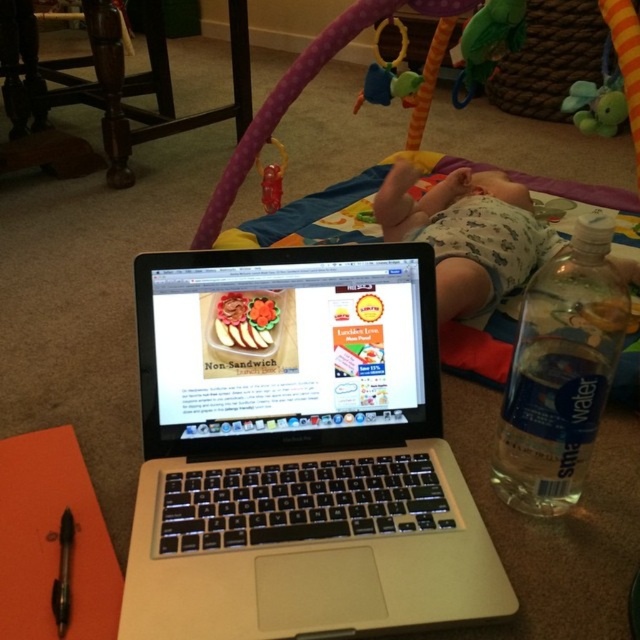
Which is below, green matte teether at upper right or rubberized plastic baby rattle at upper center?

green matte teether at upper right

Can you confirm if green matte teether at upper right is shorter than rubberized plastic baby rattle at upper center?

Indeed, green matte teether at upper right has a lesser height compared to rubberized plastic baby rattle at upper center.

Where is `green matte teether at upper right`? Image resolution: width=640 pixels, height=640 pixels. green matte teether at upper right is located at coordinates (596, 106).

Does silver/black plastic laptop at center come in front of green rubber teether at upper center?

Yes, it is.

Is silver/black plastic laptop at center bigger than green rubber teether at upper center?

Actually, silver/black plastic laptop at center might be smaller than green rubber teether at upper center.

Image resolution: width=640 pixels, height=640 pixels. Describe the element at coordinates (285, 349) in the screenshot. I see `silver/black plastic laptop at center` at that location.

This screenshot has height=640, width=640. What are the coordinates of `silver/black plastic laptop at center` in the screenshot? It's located at (285, 349).

Image resolution: width=640 pixels, height=640 pixels. What do you see at coordinates (285, 349) in the screenshot?
I see `silver/black plastic laptop at center` at bounding box center [285, 349].

Which is more to the left, silver/black plastic laptop at center or green matte teether at upper right?

silver/black plastic laptop at center is more to the left.

Describe the element at coordinates (285, 349) in the screenshot. I see `silver/black plastic laptop at center` at that location.

Identify the location of silver/black plastic laptop at center. This screenshot has height=640, width=640. (285, 349).